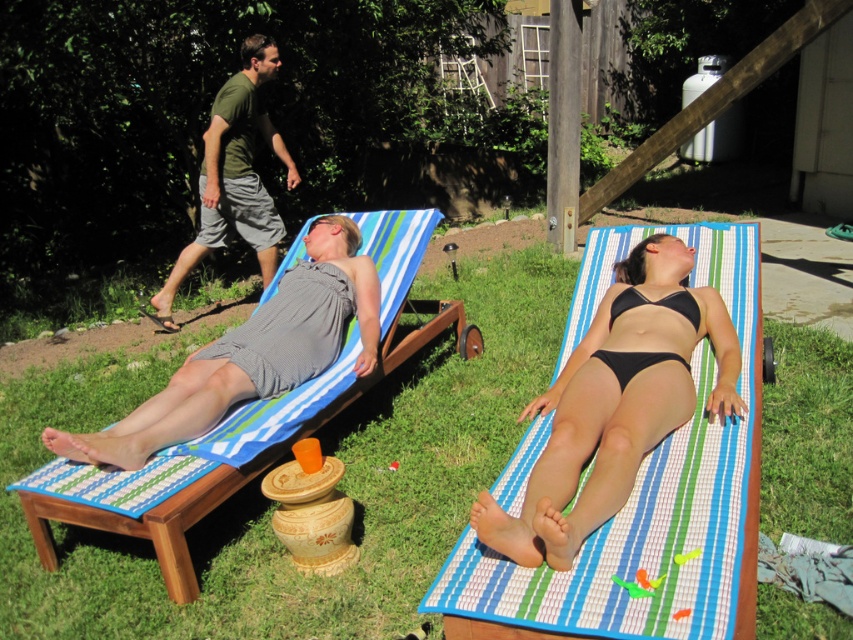
Image resolution: width=853 pixels, height=640 pixels. Describe the element at coordinates (270, 500) in the screenshot. I see `green grass at lower center` at that location.

Based on the photo, is green grass at lower center thinner than gray striped dress at left?

Incorrect, green grass at lower center's width is not less than gray striped dress at left's.

At what (x,y) coordinates should I click in order to perform the action: click on green grass at lower center. Please return your answer as a coordinate pair (x, y). Looking at the image, I should click on (270, 500).

Where is `green grass at lower center`? green grass at lower center is located at coordinates (270, 500).

Is green grass at lower center taller than black bikini at center?

Correct, green grass at lower center is much taller as black bikini at center.

Is green grass at lower center in front of black bikini at center?

No, green grass at lower center is further to the viewer.

Who is more forward, [776,602] or [585,358]?

Positioned in front is point [776,602].

You are a GUI agent. You are given a task and a screenshot of the screen. Output one action in this format:
    pyautogui.click(x=<x>, y=<y>)
    Task: Click on the green grass at lower center
    This screenshot has width=853, height=640.
    Given the screenshot: What is the action you would take?
    pyautogui.click(x=270, y=500)

Can you confirm if wooden daybed at left is positioned to the left of green fabric shorts at upper left?

No, wooden daybed at left is not to the left of green fabric shorts at upper left.

Is wooden daybed at left above green fabric shorts at upper left?

No.

Find the location of a particular element. The image size is (853, 640). wooden daybed at left is located at coordinates (238, 426).